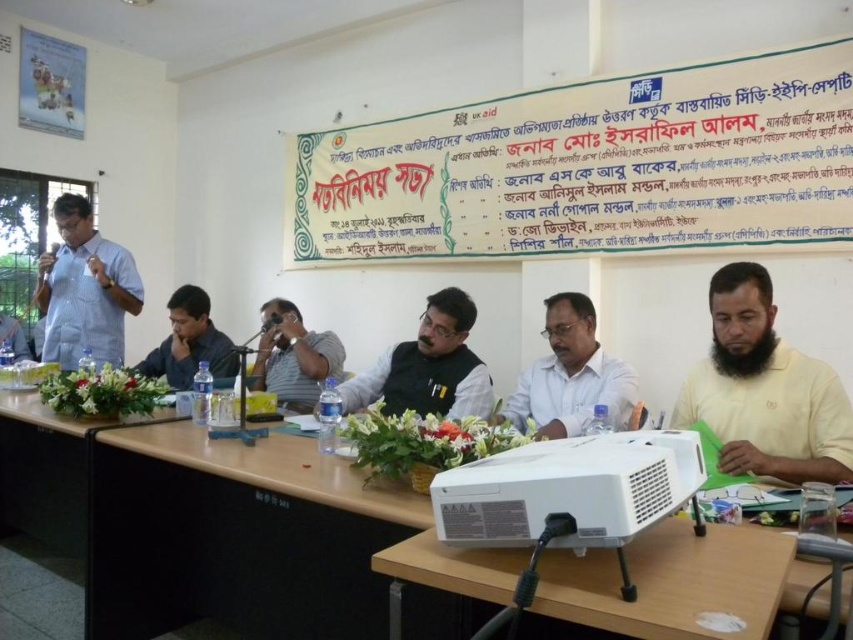
Between point (585, 609) and point (834, 376), which one is positioned behind?

The point (834, 376) is behind.

Is white plastic projector at lower center below yellow cotton shirt at right?

Yes, white plastic projector at lower center is below yellow cotton shirt at right.

Does point (587, 580) come behind point (813, 476)?

No, it is not.

Identify the location of white plastic projector at lower center. click(x=672, y=582).

Can you confirm if white paper at upper center is shorter than white glossy shirt at center?

In fact, white paper at upper center may be taller than white glossy shirt at center.

Is point (366, 134) positioned after point (541, 413)?

Yes, point (366, 134) is behind point (541, 413).

Is point (485, 157) closer to camera compared to point (576, 307)?

That is False.

At what (x,y) coordinates should I click in order to perform the action: click on white paper at upper center. Please return your answer as a coordinate pair (x, y). The height and width of the screenshot is (640, 853). Looking at the image, I should click on (590, 168).

How much distance is there between white checkered shirt at left and gray fabric shirt at center?

white checkered shirt at left is 1.04 meters from gray fabric shirt at center.

In the scene shown: Can you confirm if white checkered shirt at left is positioned to the right of gray fabric shirt at center?

Incorrect, white checkered shirt at left is not on the right side of gray fabric shirt at center.

Is point (131, 308) positioned in front of point (321, 344)?

That is False.

Locate an element on the screen. The height and width of the screenshot is (640, 853). white checkered shirt at left is located at coordinates (84, 289).